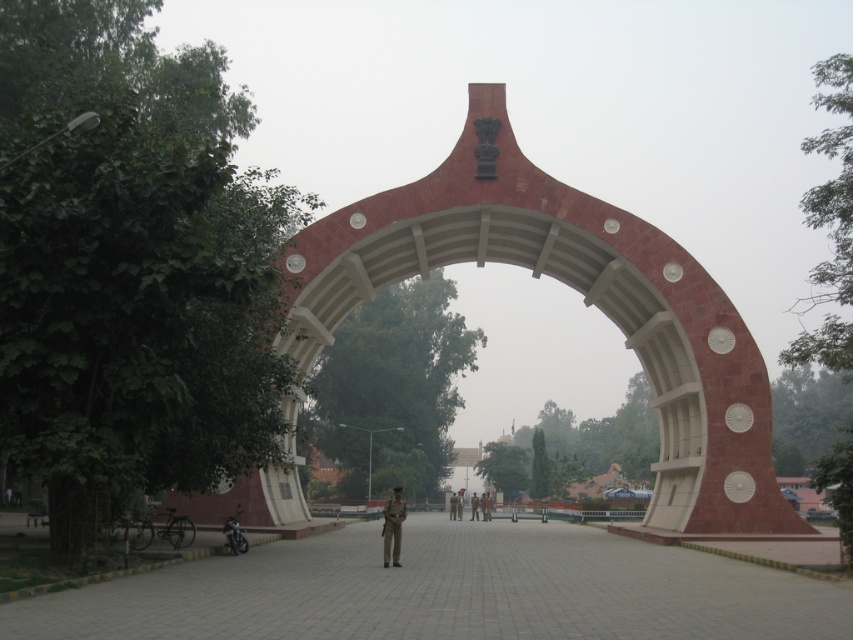
You are standing in the public square and want to walk towards the archway. There are two points marked on the ground, point (386, 557) and point (473, 500). Which point should you step on first if you want to reach the archway as quickly as possible?

You should step on point (386, 557) first because it is closer to the viewer, so it is the nearest point to start moving towards the archway.

You are a tour guide leading a group to the red stone archway at center. You notice the paved stone path at center is the only path leading to it. If the path is 2 meters wide, can your group of 10 people walk side by side on the path towards the archway?

The red stone archway at center and paved stone path at center are 22.91 meters apart. The path is 2 meters wide, so a group of 10 people can walk side by side on the paved stone path at center as the width allows for multiple people to walk together.